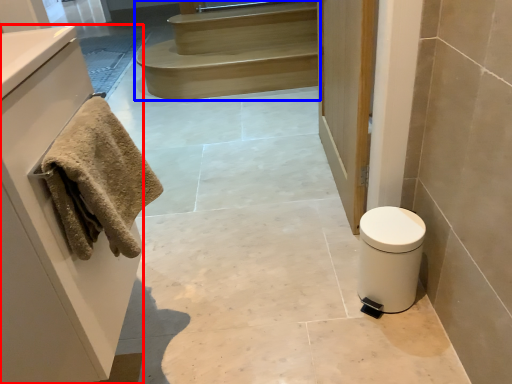
Question: Which object is further to the camera taking this photo, cabinetry (highlighted by a red box) or stairs (highlighted by a blue box)?

Choices:
 (A) cabinetry
 (B) stairs

Answer: (B)